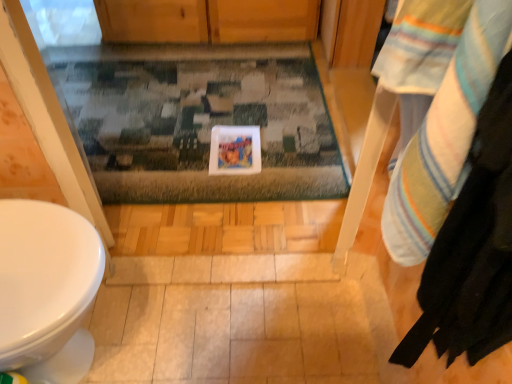
The width and height of the screenshot is (512, 384). Identify the location of striped cotton towel at right. (460, 199).

This screenshot has height=384, width=512. What do you see at coordinates (460, 199) in the screenshot?
I see `striped cotton towel at right` at bounding box center [460, 199].

The height and width of the screenshot is (384, 512). Find the location of `multicolored textured rug at center`. multicolored textured rug at center is located at coordinates (197, 120).

The image size is (512, 384). What do you see at coordinates (197, 120) in the screenshot? I see `multicolored textured rug at center` at bounding box center [197, 120].

What are the coordinates of `striped cotton towel at right` in the screenshot? It's located at (460, 199).

Is multicolored textured rug at center to the left or to the right of striped cotton towel at right in the image?

multicolored textured rug at center is positioned on striped cotton towel at right's left side.

In the image, is multicolored textured rug at center positioned in front of or behind striped cotton towel at right?

Visually, multicolored textured rug at center is located behind striped cotton towel at right.

Which is less distant, (74, 110) or (508, 205)?

Point (508, 205)

From the image's perspective, which one is positioned lower, multicolored textured rug at center or striped cotton towel at right?

striped cotton towel at right.

From a real-world perspective, relative to striped cotton towel at right, is multicolored textured rug at center vertically above or below?

multicolored textured rug at center is situated lower than striped cotton towel at right in the real world.

Can you confirm if multicolored textured rug at center is thinner than striped cotton towel at right?

Incorrect, the width of multicolored textured rug at center is not less than that of striped cotton towel at right.

Considering the sizes of objects multicolored textured rug at center and striped cotton towel at right in the image provided, who is taller, multicolored textured rug at center or striped cotton towel at right?

striped cotton towel at right is taller.

Between multicolored textured rug at center and striped cotton towel at right, which one has larger size?

A: multicolored textured rug at center is bigger.

Is multicolored textured rug at center located outside striped cotton towel at right?

Yes, multicolored textured rug at center is outside of striped cotton towel at right.

Would you consider multicolored textured rug at center to be distant from striped cotton towel at right?

Yes, multicolored textured rug at center is far from striped cotton towel at right.

Is multicolored textured rug at center facing away from striped cotton towel at right?

That's not correct — multicolored textured rug at center is not looking away from striped cotton towel at right.

How many degrees apart are the facing directions of multicolored textured rug at center and striped cotton towel at right?

The angle between the facing direction of multicolored textured rug at center and the facing direction of striped cotton towel at right is 84.5 degrees.

The image size is (512, 384). Identify the location of laundry that appears above the multicolored textured rug at center (from a real-world perspective). (460, 199).

Which object is positioned more to the right, striped cotton towel at right or multicolored textured rug at center?

Positioned to the right is striped cotton towel at right.

Is striped cotton towel at right positioned in front of multicolored textured rug at center?

Yes, striped cotton towel at right is in front of multicolored textured rug at center.

Between point (402, 351) and point (141, 136), which one is positioned in front?

Positioned in front is point (402, 351).

From the image's perspective, would you say striped cotton towel at right is shown under multicolored textured rug at center?

Yes, from the image's perspective, striped cotton towel at right is beneath multicolored textured rug at center.

In the scene shown: From a real-world perspective, does striped cotton towel at right stand above multicolored textured rug at center?

Yes, from a real-world perspective, striped cotton towel at right is above multicolored textured rug at center.

Which of these two, striped cotton towel at right or multicolored textured rug at center, is thinner?

Thinner between the two is striped cotton towel at right.

Considering the relative sizes of striped cotton towel at right and multicolored textured rug at center in the image provided, is striped cotton towel at right shorter than multicolored textured rug at center?

Incorrect, the height of striped cotton towel at right does not fall short of that of multicolored textured rug at center.

Between striped cotton towel at right and multicolored textured rug at center, which one has smaller size?

With smaller size is striped cotton towel at right.

Is striped cotton towel at right positioned beyond the bounds of multicolored textured rug at center?

striped cotton towel at right lies outside multicolored textured rug at center's area.

Would you consider striped cotton towel at right to be distant from multicolored textured rug at center?

Yes, striped cotton towel at right and multicolored textured rug at center are located far from each other.

Is striped cotton towel at right facing towards multicolored textured rug at center?

No, striped cotton towel at right is not oriented towards multicolored textured rug at center.

Can you tell me how much striped cotton towel at right and multicolored textured rug at center differ in facing direction?

striped cotton towel at right and multicolored textured rug at center are facing 84.5 degrees away from each other.

Where is `laundry located on the right of multicolored textured rug at center`? laundry located on the right of multicolored textured rug at center is located at coordinates (460, 199).

The image size is (512, 384). In order to click on bath mat above the striped cotton towel at right (from the image's perspective) in this screenshot , I will do `click(197, 120)`.

This screenshot has height=384, width=512. I want to click on laundry on the right of the multicolored textured rug at center, so click(x=460, y=199).